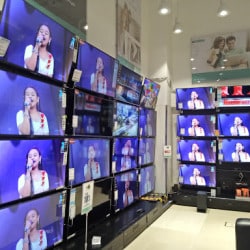
I want to click on ceiling, so click(189, 9).